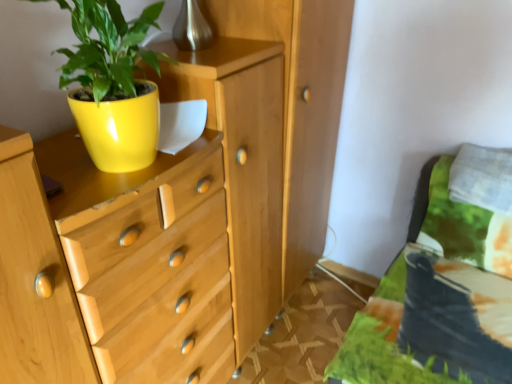
Question: From a real-world perspective, is matte wood chest of drawers at left positioned above or below white soft pillow at upper right?

Choices:
 (A) below
 (B) above

Answer: (A)

Question: Is matte wood chest of drawers at left wider or thinner than white soft pillow at upper right?

Choices:
 (A) thin
 (B) wide

Answer: (B)

Question: Estimate the real-world distances between objects in this image. Which object is farther from the matte yellow pot at upper left?

Choices:
 (A) white soft pillow at upper right
 (B) matte wood chest of drawers at left
 (C) yellow glossy flowerpot at upper left

Answer: (A)

Question: Estimate the real-world distances between objects in this image. Which object is closer to the matte wood chest of drawers at left?

Choices:
 (A) white soft pillow at upper right
 (B) matte yellow pot at upper left
 (C) yellow glossy flowerpot at upper left

Answer: (B)